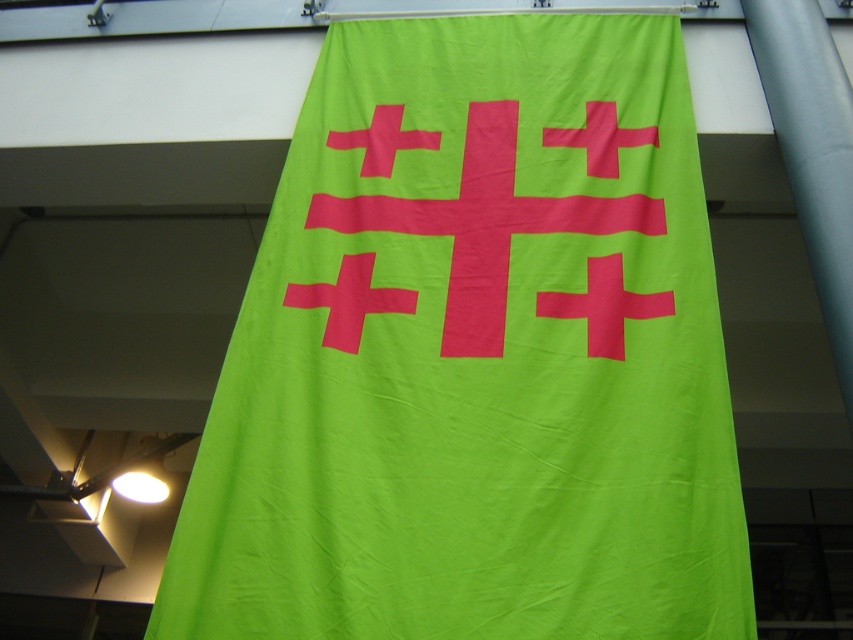
Measure the distance between point (x=691, y=241) and camera.

They are 7.39 feet apart.

Measure the distance from lime green fabric flag at center to bright pink fabric cross at center.

lime green fabric flag at center and bright pink fabric cross at center are 4.91 inches apart from each other.

Between point (627, 557) and point (378, 138), which one is positioned in front?

Point (627, 557)

The height and width of the screenshot is (640, 853). I want to click on lime green fabric flag at center, so click(474, 355).